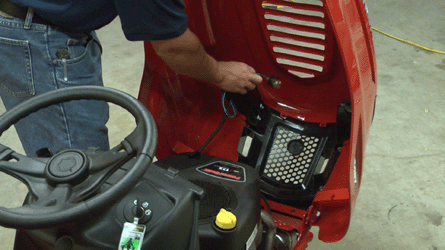
The width and height of the screenshot is (445, 250). In order to click on power cord in this screenshot , I will do pyautogui.click(x=428, y=48).